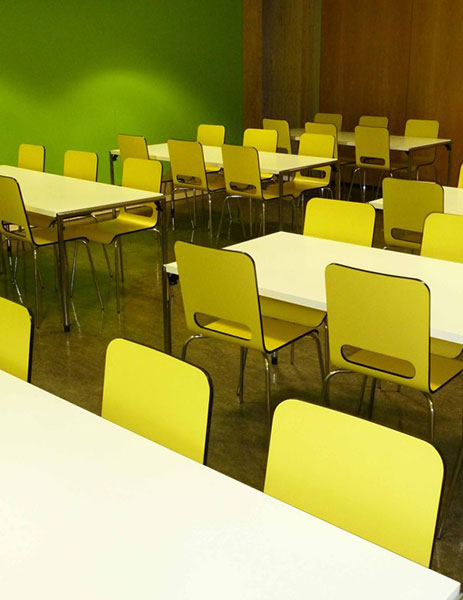
This screenshot has height=600, width=463. I want to click on tables, so click(x=286, y=260), click(x=75, y=204), click(x=279, y=163), click(x=405, y=139), click(x=450, y=201), click(x=31, y=438).